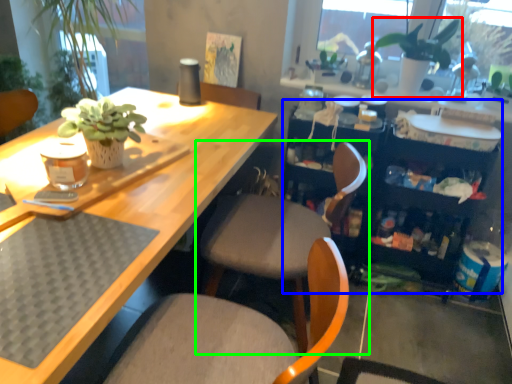
Question: Estimate the real-world distances between objects in this image. Which object is closer to houseplant (highlighted by a red box), bookshelf (highlighted by a blue box) or chair (highlighted by a green box)?

Choices:
 (A) bookshelf
 (B) chair

Answer: (A)